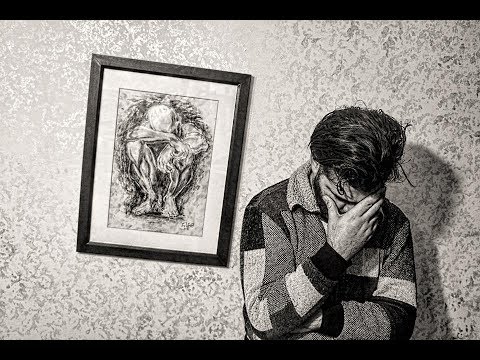
The width and height of the screenshot is (480, 360). I want to click on dark picture frame, so click(95, 77).